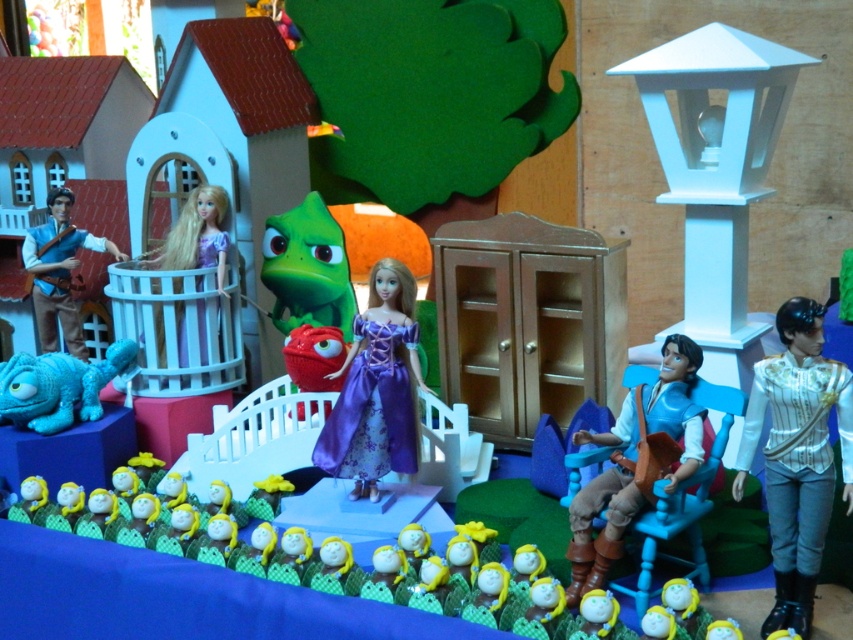
Which is above, white satin shirt at right or blue plush chameleon at lower left?

blue plush chameleon at lower left

Which is behind, point (805, 403) or point (15, 378)?

Positioned behind is point (15, 378).

In order to click on white satin shirt at right in this screenshot , I will do `click(798, 456)`.

Who is shorter, brown leather vest at center right or blue plush chameleon at lower left?

blue plush chameleon at lower left is shorter.

In order to click on brown leather vest at center right in this screenshot , I will do `click(662, 412)`.

This screenshot has width=853, height=640. What do you see at coordinates (376, 388) in the screenshot? I see `purple satin dress at center` at bounding box center [376, 388].

Describe the element at coordinates (376, 388) in the screenshot. I see `purple satin dress at center` at that location.

At what (x,y) coordinates should I click in order to perform the action: click on purple satin dress at center. Please return your answer as a coordinate pair (x, y). The height and width of the screenshot is (640, 853). Looking at the image, I should click on (376, 388).